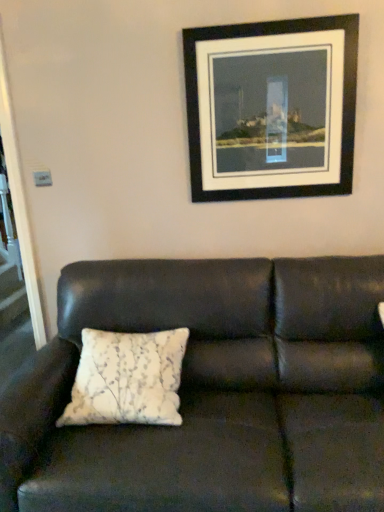
Question: Is white textured pillow at center facing towards leather couch at center?

Choices:
 (A) yes
 (B) no

Answer: (A)

Question: Does white textured pillow at center have a greater width compared to leather couch at center?

Choices:
 (A) yes
 (B) no

Answer: (B)

Question: From the image's perspective, is white textured pillow at center under leather couch at center?

Choices:
 (A) yes
 (B) no

Answer: (B)

Question: Is white textured pillow at center further to camera compared to leather couch at center?

Choices:
 (A) yes
 (B) no

Answer: (A)

Question: Can you confirm if white textured pillow at center is thinner than leather couch at center?

Choices:
 (A) no
 (B) yes

Answer: (B)

Question: From the image's perspective, is white textured pillow at center located above or below black matte picture frame at upper center?

Choices:
 (A) above
 (B) below

Answer: (B)

Question: Looking at their shapes, would you say white textured pillow at center is wider or thinner than black matte picture frame at upper center?

Choices:
 (A) thin
 (B) wide

Answer: (B)

Question: In the image, is white textured pillow at center positioned in front of or behind black matte picture frame at upper center?

Choices:
 (A) behind
 (B) front

Answer: (B)

Question: Based on their sizes in the image, would you say white textured pillow at center is bigger or smaller than black matte picture frame at upper center?

Choices:
 (A) small
 (B) big

Answer: (B)

Question: Is white textured pillow at center wider or thinner than leather couch at center?

Choices:
 (A) wide
 (B) thin

Answer: (B)

Question: In terms of height, does white textured pillow at center look taller or shorter compared to leather couch at center?

Choices:
 (A) tall
 (B) short

Answer: (B)

Question: In terms of size, does white textured pillow at center appear bigger or smaller than leather couch at center?

Choices:
 (A) small
 (B) big

Answer: (A)

Question: Considering the positions of point 79,361 and point 225,329, is point 79,361 closer or farther from the camera than point 225,329?

Choices:
 (A) closer
 (B) farther

Answer: (A)

Question: From a real-world perspective, is leather couch at center above or below white textured pillow at center?

Choices:
 (A) above
 (B) below

Answer: (B)

Question: In terms of height, does leather couch at center look taller or shorter compared to white textured pillow at center?

Choices:
 (A) short
 (B) tall

Answer: (B)